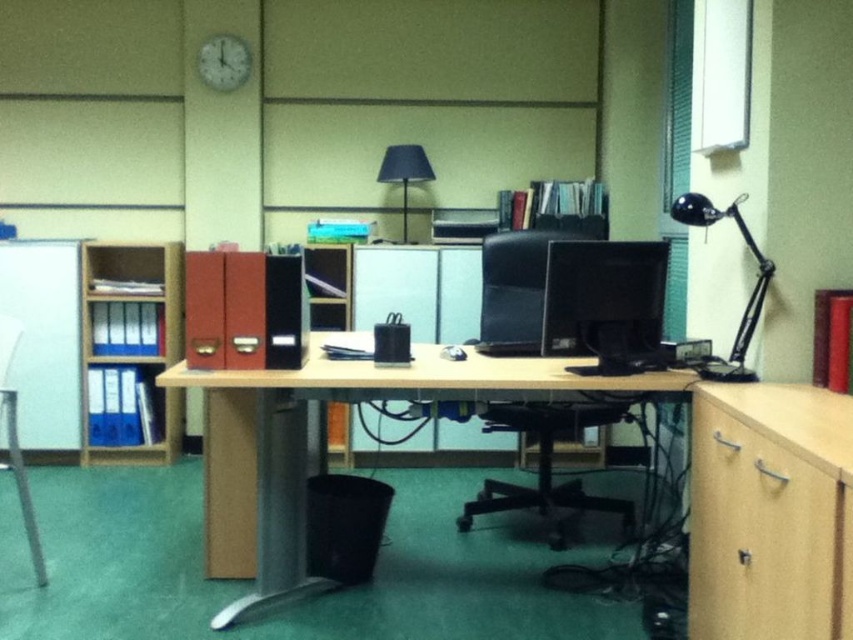
You are organizing the desk and need to place a new keyboard that requires 10 cm of space. Given the space between the matte black monitor at center and the matte black chair at center, will there be enough space to fit the keyboard?

The matte black monitor at center is thinner than the matte black chair at center, so the space between them is sufficient to fit a keyboard requiring 10 cm of space.

You are organizing the office and need to place a new item between the black plastic swivel chair at center and the black metal desk lamp at upper right. Based on their positions, where should you place the item?

The black plastic swivel chair at center is below the black metal desk lamp at upper right, so placing the new item between them would require positioning it above the chair but below the lamp.